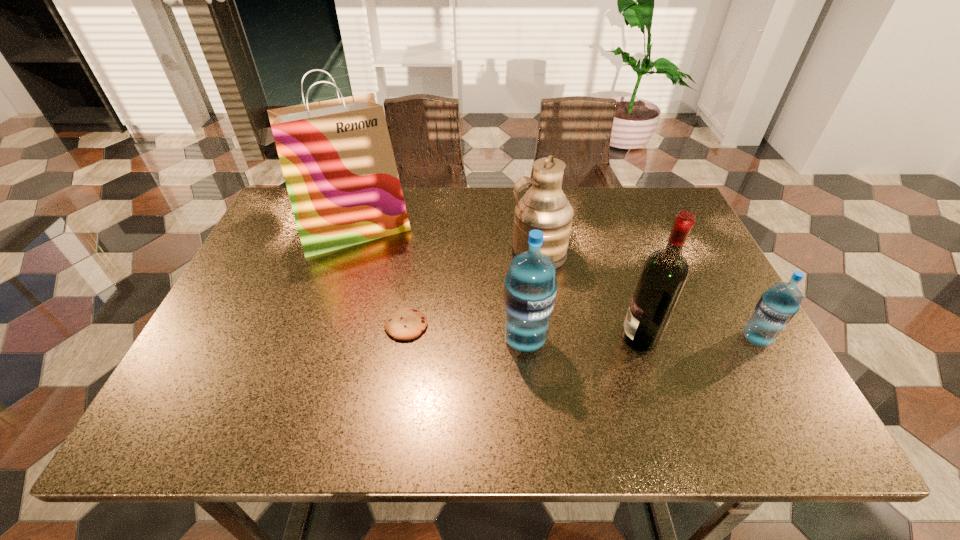
Find the location of `free space at the far edge of the desktop`. free space at the far edge of the desktop is located at coordinates point(457,228).

At what (x,y) coordinates should I click in order to perform the action: click on vacant space at the near edge. Please return your answer as a coordinate pair (x, y). Looking at the image, I should click on (588, 374).

Locate an element on the screen. The image size is (960, 540). vacant position at the left edge of the desktop is located at coordinates (265, 343).

This screenshot has height=540, width=960. Identify the location of vacant space at the right edge of the desktop. (708, 287).

Locate an element on the screen. Image resolution: width=960 pixels, height=540 pixels. free region at the near left corner of the desktop is located at coordinates (258, 360).

The height and width of the screenshot is (540, 960). I want to click on vacant space at the far right corner of the desktop, so click(634, 207).

This screenshot has height=540, width=960. In order to click on vacant area that lies between the taller water bottle and the tallest object in this screenshot , I will do pyautogui.click(x=440, y=285).

Identify the location of free point between the alcohol and the left water bottle. The width and height of the screenshot is (960, 540). (583, 339).

This screenshot has height=540, width=960. What are the coordinates of `empty space that is in between the pitcher and the cookie` in the screenshot? It's located at (472, 290).

You are a GUI agent. You are given a task and a screenshot of the screen. Output one action in this format:
    pyautogui.click(x=<x>, y=<y>)
    Task: Click on the vacant space in between the tallest object and the taller water bottle
    
    Given the screenshot: What is the action you would take?
    pyautogui.click(x=440, y=285)